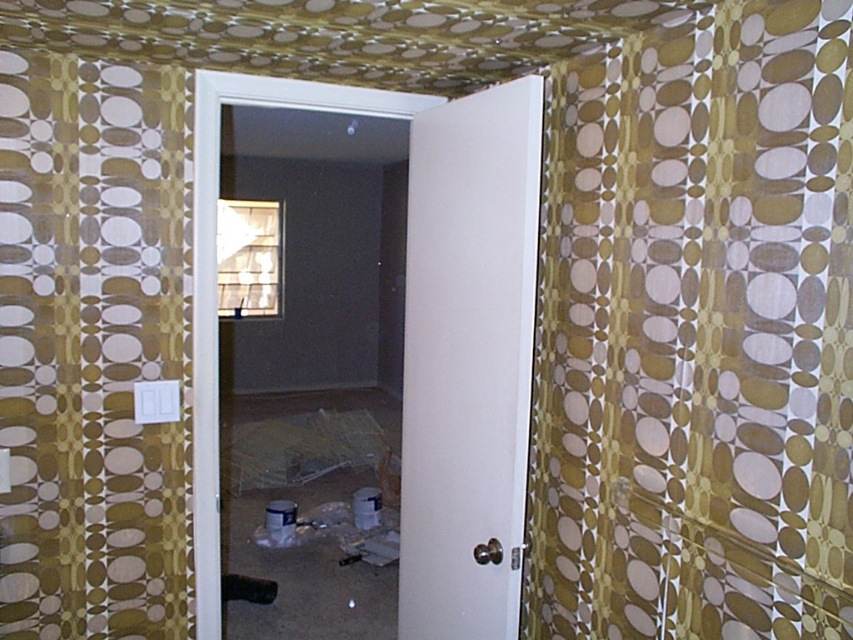
Question: Is gold-patterned fabric curtain at center below gold textured curtain at left?

Choices:
 (A) yes
 (B) no

Answer: (A)

Question: Does gold-patterned fabric curtain at center appear over gold textured curtain at left?

Choices:
 (A) yes
 (B) no

Answer: (B)

Question: Does gold-patterned fabric curtain at center have a greater width compared to gold textured curtain at left?

Choices:
 (A) yes
 (B) no

Answer: (B)